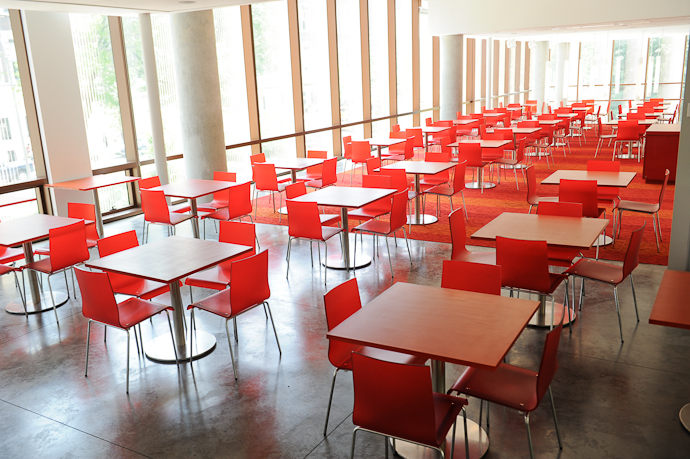
Image resolution: width=690 pixels, height=459 pixels. I want to click on columns, so click(x=193, y=104), click(x=450, y=69), click(x=542, y=56), click(x=560, y=58).